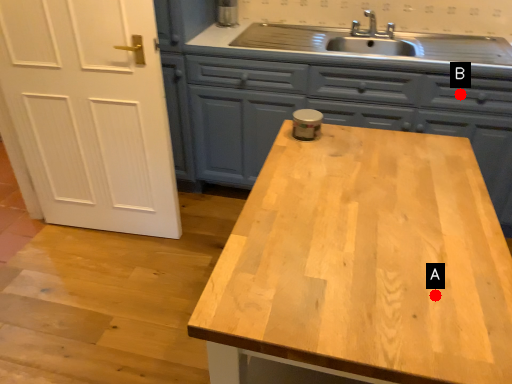
Question: Two points are circled on the image, labeled by A and B beside each circle. Which of the following is the closest to the observer?

Choices:
 (A) A is closer
 (B) B is closer

Answer: (A)